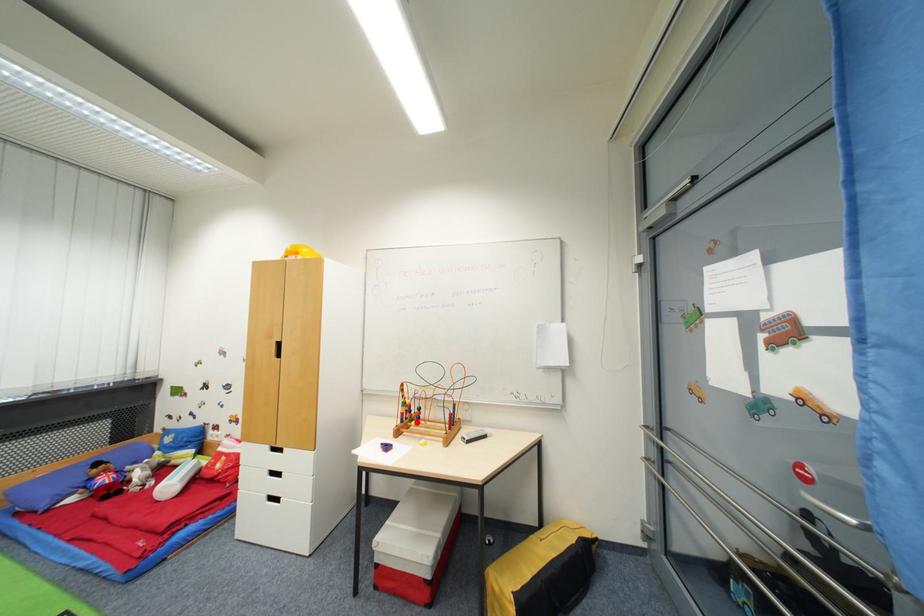
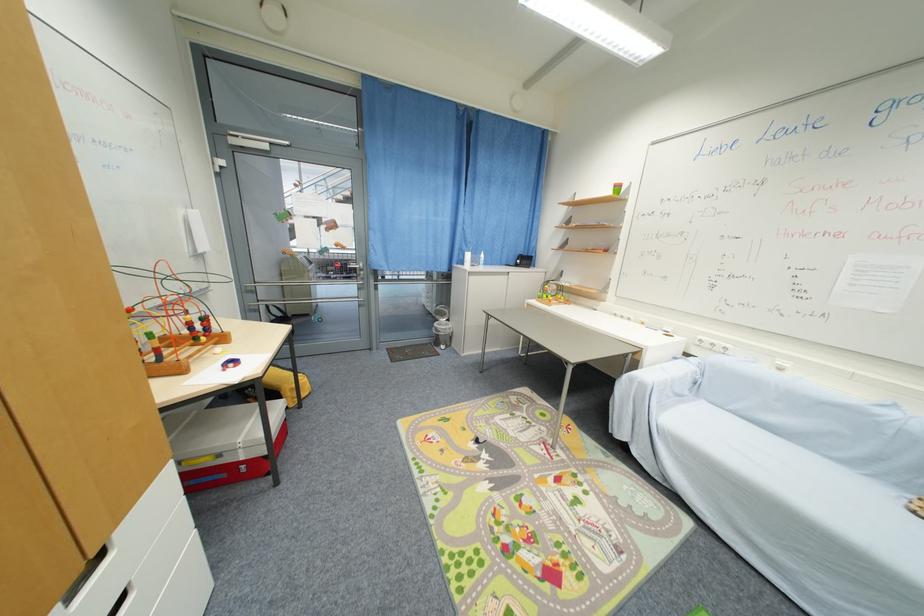
In the second image, find the point that corresponds to the highlighted location in the first image.

(201, 341)